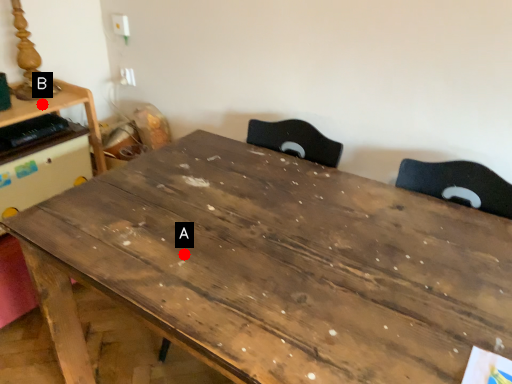
Question: Two points are circled on the image, labeled by A and B beside each circle. Which point is further to the camera?

Choices:
 (A) A is further
 (B) B is further

Answer: (B)